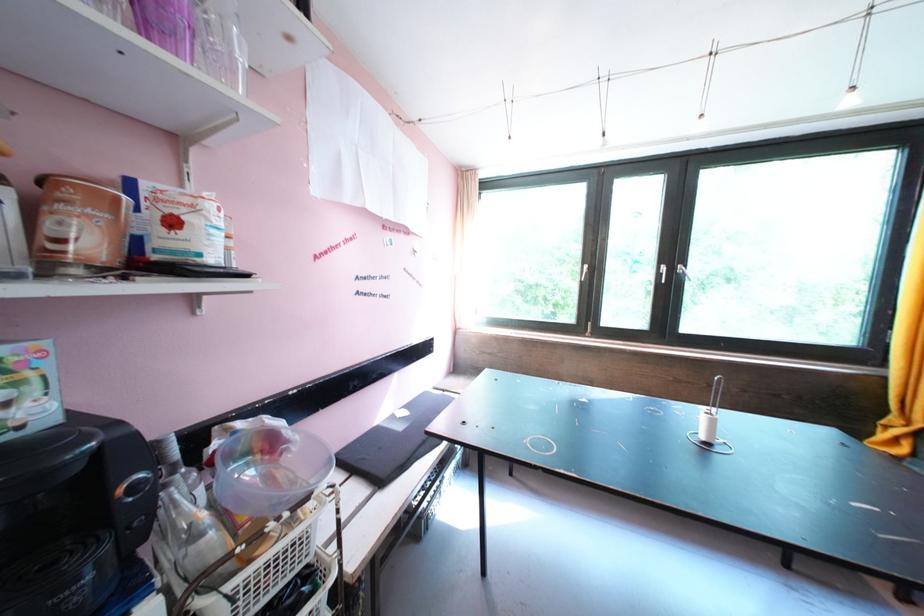
Where is `clear plastic bowl`? clear plastic bowl is located at coordinates [270, 469].